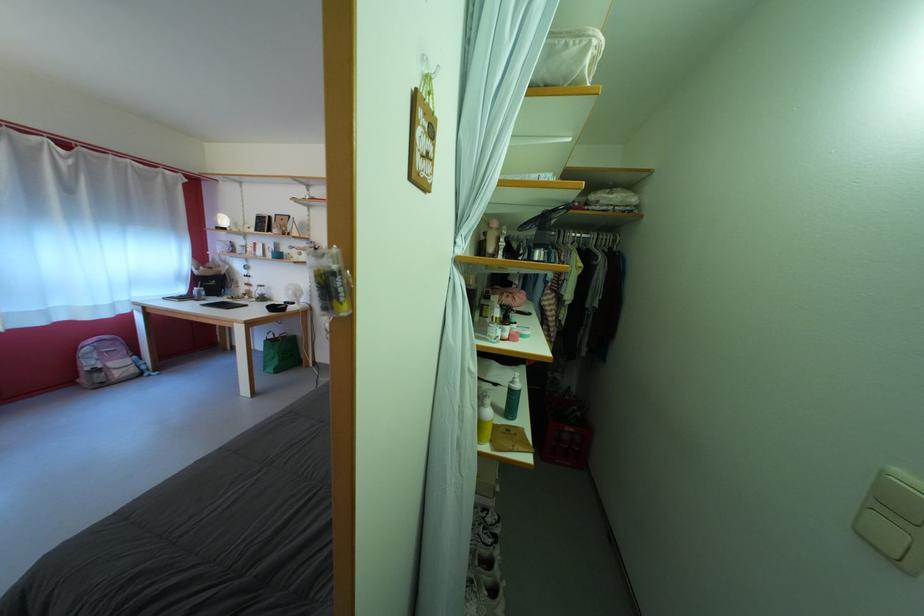
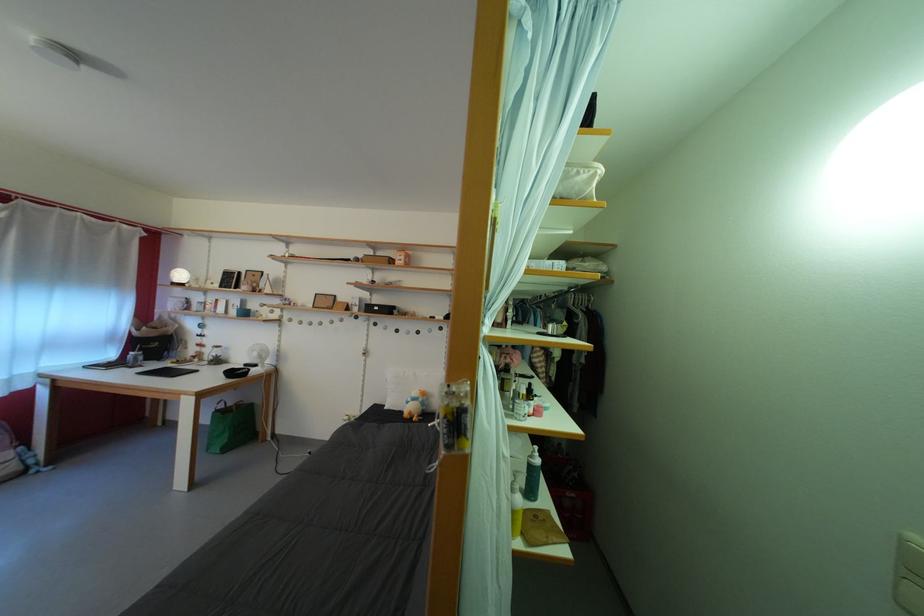
Question: Based on the continuous images, in which direction is the camera rotating? Reply with the corresponding letter.

Choices:
 (A) Left
 (B) Right
 (C) Up
 (D) Down

Answer: (C)